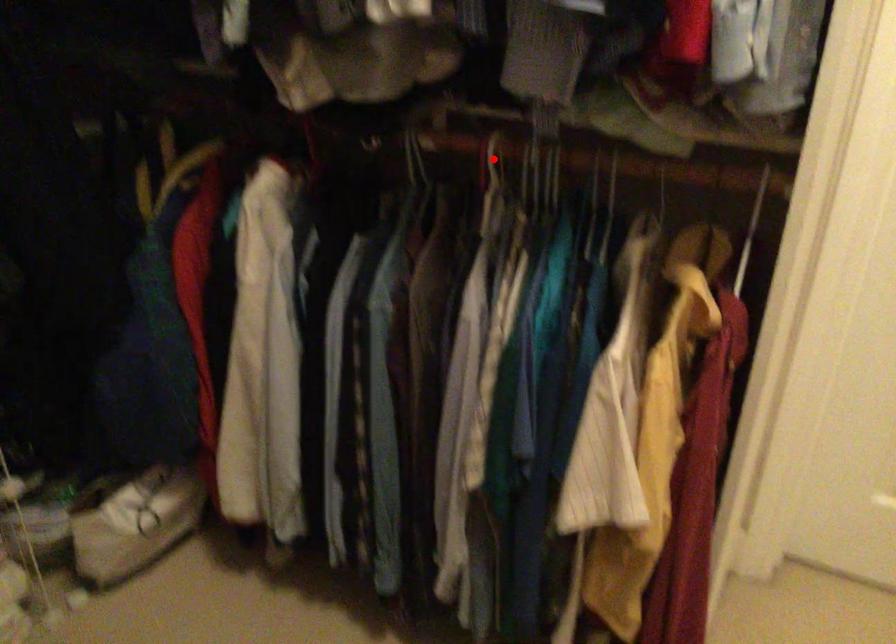
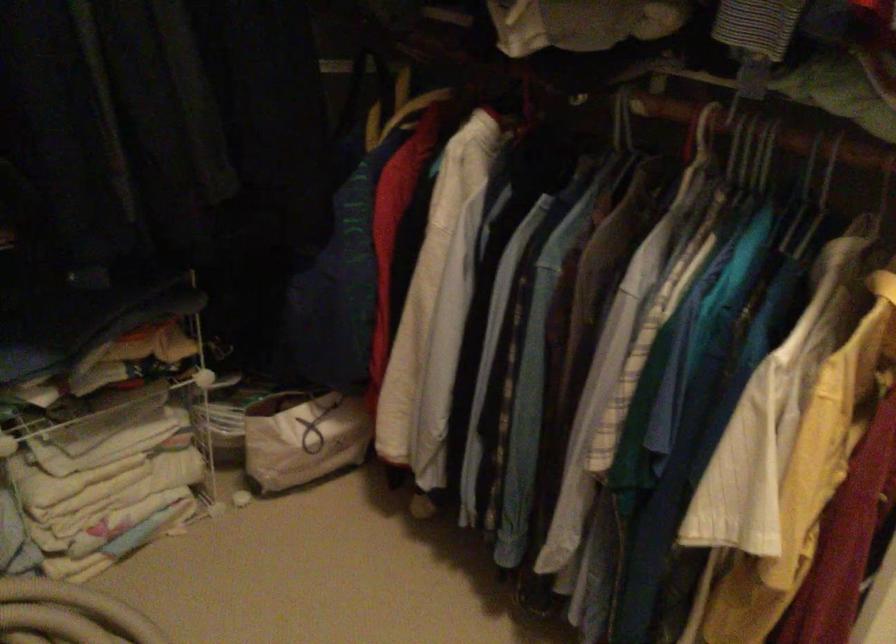
In the second image, find the point that corresponds to the highlighted location in the first image.

(702, 134)